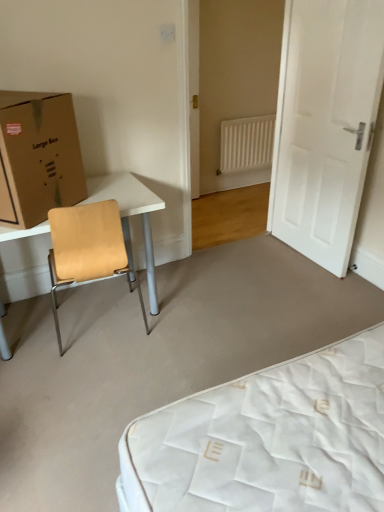
Question: Can you confirm if white plastic radiator at center is thinner than brown cardboard box at left?

Choices:
 (A) no
 (B) yes

Answer: (B)

Question: From a real-world perspective, is white plastic radiator at center over brown cardboard box at left?

Choices:
 (A) yes
 (B) no

Answer: (B)

Question: Is white plastic radiator at center looking in the opposite direction of brown cardboard box at left?

Choices:
 (A) yes
 (B) no

Answer: (B)

Question: Is white plastic radiator at center oriented towards brown cardboard box at left?

Choices:
 (A) no
 (B) yes

Answer: (A)

Question: Is white plastic radiator at center bigger than brown cardboard box at left?

Choices:
 (A) no
 (B) yes

Answer: (A)

Question: From a real-world perspective, relative to white matte door at right, is brown cardboard box at left vertically above or below?

Choices:
 (A) above
 (B) below

Answer: (A)

Question: Considering the positions of brown cardboard box at left and white matte door at right in the image, is brown cardboard box at left wider or thinner than white matte door at right?

Choices:
 (A) wide
 (B) thin

Answer: (A)

Question: Is point (57, 113) closer or farther from the camera than point (340, 181)?

Choices:
 (A) closer
 (B) farther

Answer: (A)

Question: Is brown cardboard box at left taller or shorter than white matte door at right?

Choices:
 (A) tall
 (B) short

Answer: (B)

Question: In terms of width, does brown cardboard box at left look wider or thinner when compared to white plastic radiator at center?

Choices:
 (A) wide
 (B) thin

Answer: (A)

Question: From their relative heights in the image, would you say brown cardboard box at left is taller or shorter than white plastic radiator at center?

Choices:
 (A) tall
 (B) short

Answer: (B)

Question: From the image's perspective, is brown cardboard box at left positioned above or below white plastic radiator at center?

Choices:
 (A) below
 (B) above

Answer: (A)

Question: Which is correct: brown cardboard box at left is inside white plastic radiator at center, or outside of it?

Choices:
 (A) outside
 (B) inside

Answer: (A)

Question: Considering their positions, is light brown wood table at left located in front of or behind white matte door at right?

Choices:
 (A) behind
 (B) front

Answer: (B)

Question: From a real-world perspective, is light brown wood table at left above or below white matte door at right?

Choices:
 (A) below
 (B) above

Answer: (A)